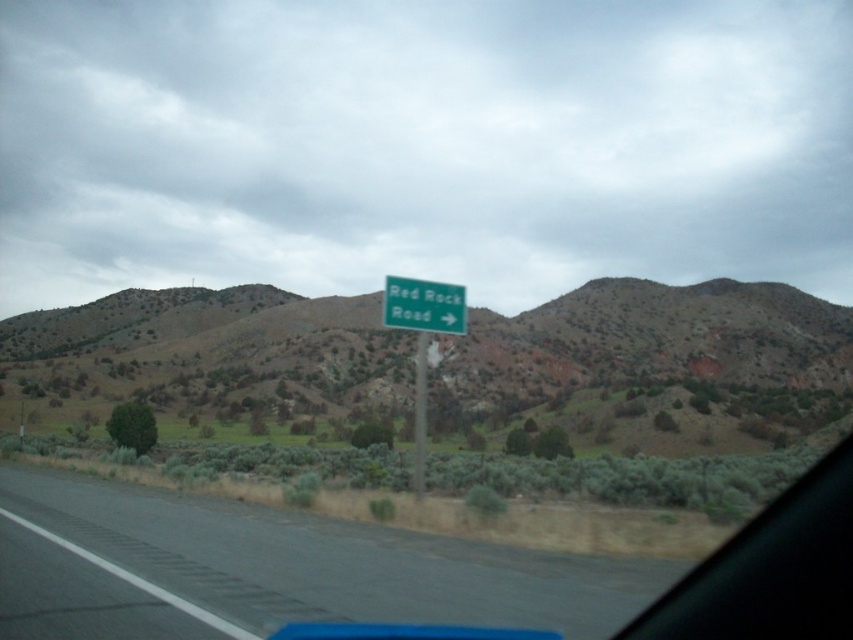
Question: Can you confirm if green grassy hill at center is positioned to the right of gray asphalt road at center?

Choices:
 (A) no
 (B) yes

Answer: (B)

Question: Which point is closer to the camera taking this photo?

Choices:
 (A) (291, 550)
 (B) (18, 372)

Answer: (A)

Question: Is green plastic sign at center above green metallic sign at center?

Choices:
 (A) no
 (B) yes

Answer: (A)

Question: Which object is the closest to the green plastic sign at center?

Choices:
 (A) gray asphalt road at center
 (B) green grassy hill at center

Answer: (A)

Question: Estimate the real-world distances between objects in this image. Which object is farther from the green plastic sign at center?

Choices:
 (A) green metallic sign at center
 (B) gray asphalt road at center
 (C) green grassy hill at center

Answer: (C)

Question: From the image, what is the correct spatial relationship of gray asphalt road at center in relation to green metallic sign at center?

Choices:
 (A) above
 (B) below

Answer: (B)